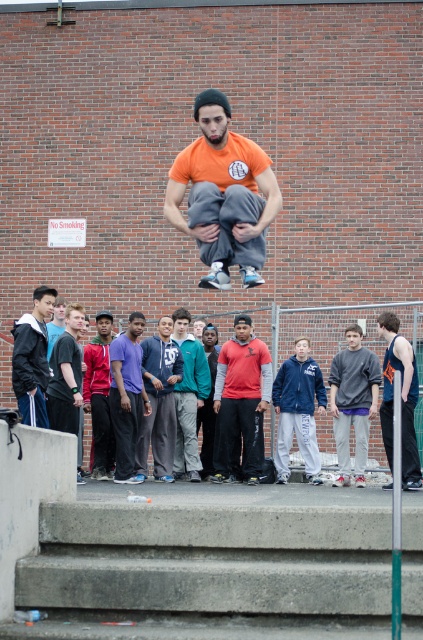
You are a photographer trying to capture the central figure mid jump. You notice two points on his body labeled as point (258, 381) and point (379, 371). Which of these points will appear larger in your camera frame?

Point (258, 381) is closer to the camera than point (379, 371), so it will appear larger in the camera frame.